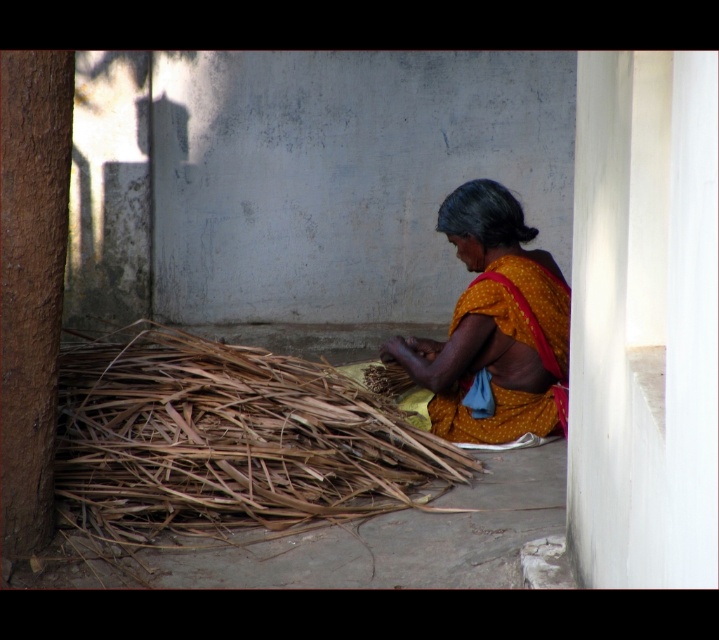
Consider the image. You are a designer looking to create a new textile pattern inspired by the items in the image. You have the brown dry reed at lower left and the yellow dotted fabric at center. Which item should you choose if you want to incorporate a larger element into your design?

The brown dry reed at lower left is bigger than the yellow dotted fabric at center, so you should choose the brown dry reed at lower left for a larger element in your design.

The woman is sitting on the ground surrounded by items. Which object, the brown dry reed at lower left or the yellow dotted fabric at center, is shorter in height?

The brown dry reed at lower left is shorter than the yellow dotted fabric at center.